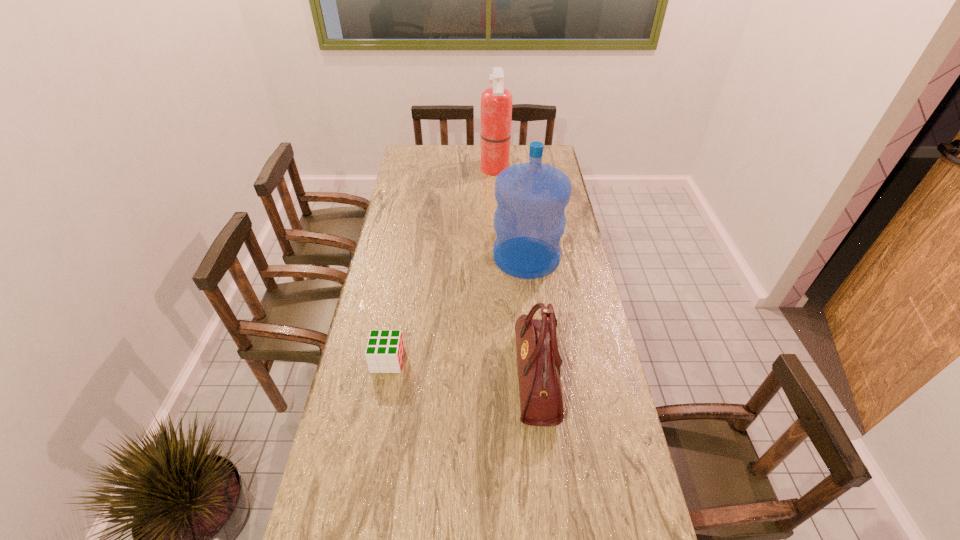
Identify the location of free space located 0.320m on the front-facing side of the third tallest object. This screenshot has width=960, height=540. (410, 377).

In order to click on vacant space located 0.210m on the front-facing side of the third tallest object in this screenshot , I will do `click(446, 377)`.

Where is `vacant space situated 0.120m on the red face of the shortest object`? This screenshot has height=540, width=960. vacant space situated 0.120m on the red face of the shortest object is located at coordinates (442, 361).

Find the location of a particular element. The height and width of the screenshot is (540, 960). object at the far edge is located at coordinates (496, 102).

Where is `object at the left edge`? This screenshot has width=960, height=540. object at the left edge is located at coordinates (384, 353).

Identify the location of object positioned at the right edge. (529, 221).

In the image, there is a desktop. At what (x,y) coordinates should I click in order to perform the action: click on vacant area at the far edge. Please return your answer as a coordinate pair (x, y). Looking at the image, I should click on (474, 168).

Locate an element on the screen. Image resolution: width=960 pixels, height=540 pixels. vacant space at the left edge is located at coordinates (381, 243).

Locate an element on the screen. vacant space at the right edge of the desktop is located at coordinates (609, 398).

This screenshot has width=960, height=540. Identify the location of free space between the cube and the handbag. (462, 369).